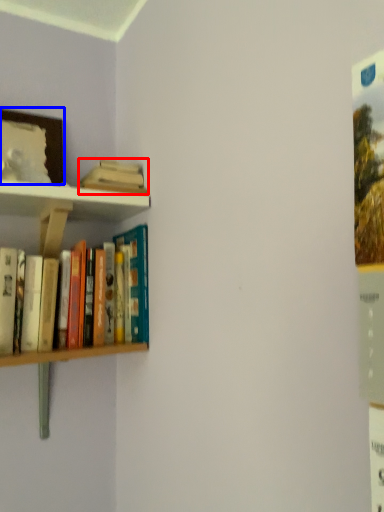
Question: Which object appears farthest to the camera in this image, book (highlighted by a red box) or picture frame (highlighted by a blue box)?

Choices:
 (A) book
 (B) picture frame

Answer: (A)